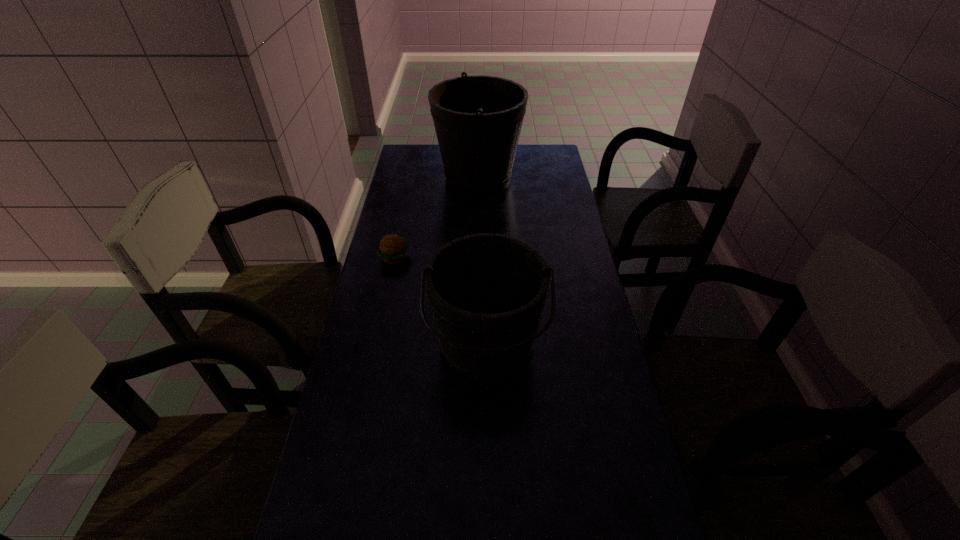
Where is `the tallest object`? Image resolution: width=960 pixels, height=540 pixels. the tallest object is located at coordinates (478, 119).

Where is `the taller bucket`? This screenshot has height=540, width=960. the taller bucket is located at coordinates (478, 119).

What are the coordinates of `the second tallest object` in the screenshot? It's located at (487, 291).

This screenshot has width=960, height=540. I want to click on the shorter bucket, so click(x=487, y=291).

Locate an element on the screen. the leftmost object is located at coordinates (392, 249).

You are a GUI agent. You are given a task and a screenshot of the screen. Output one action in this format:
    pyautogui.click(x=<x>, y=<y>)
    Task: Click on the hamburger
    This screenshot has height=540, width=960.
    Given the screenshot: What is the action you would take?
    pyautogui.click(x=392, y=249)

The width and height of the screenshot is (960, 540). In order to click on vacant area situated 0.220m on the front of the tallest object in this screenshot , I will do `click(478, 237)`.

Identify the location of vacant space positioned on the handle side of the nearest object. (488, 440).

Identify the location of vacant space located on the right of the shortest object. (450, 258).

Locate an element on the screen. object that is at the far edge is located at coordinates (478, 119).